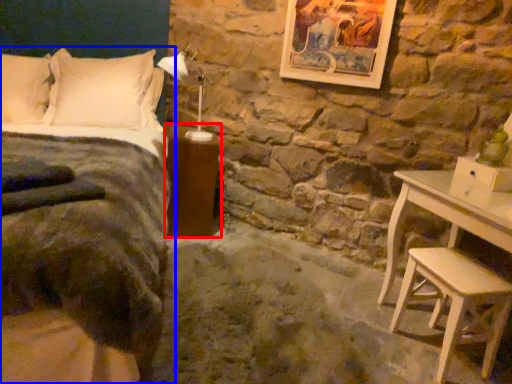
Question: Which object is further to the camera taking this photo, nightstand (highlighted by a red box) or bed (highlighted by a blue box)?

Choices:
 (A) nightstand
 (B) bed

Answer: (A)